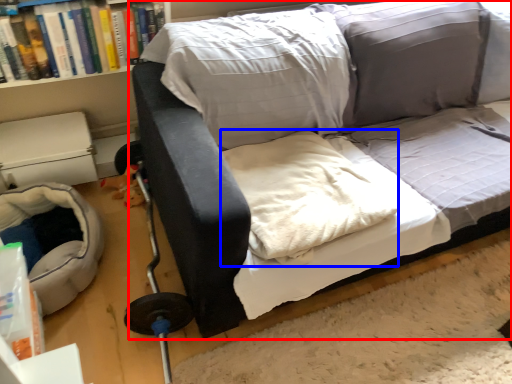
Question: Among these objects, which one is farthest to the camera, studio couch (highlighted by a red box) or linen (highlighted by a blue box)?

Choices:
 (A) studio couch
 (B) linen

Answer: (B)